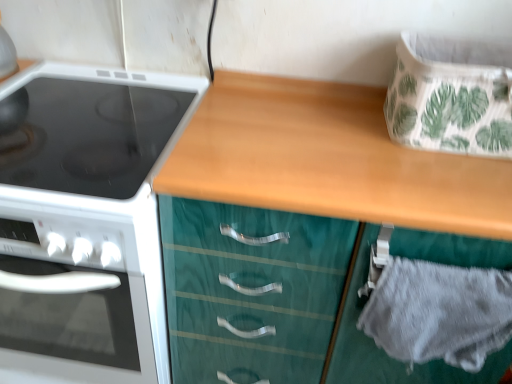
Question: Does gray fabric drawer at lower right, which ranks as the 2th cabinetry in front-to-back order, have a lesser width compared to white glossy electric stove at left?

Choices:
 (A) no
 (B) yes

Answer: (B)

Question: Are gray fabric drawer at lower right, which ranks as the 2th cabinetry in front-to-back order, and white glossy electric stove at left located far from each other?

Choices:
 (A) no
 (B) yes

Answer: (A)

Question: Does gray fabric drawer at lower right, which ranks as the 2th cabinetry in front-to-back order, have a greater width compared to white glossy electric stove at left?

Choices:
 (A) yes
 (B) no

Answer: (B)

Question: Does gray fabric drawer at lower right, which ranks as the 2th cabinetry in front-to-back order, turn towards white glossy electric stove at left?

Choices:
 (A) no
 (B) yes

Answer: (A)

Question: Is gray fabric drawer at lower right, which ranks as the 2th cabinetry in front-to-back order, not inside white glossy electric stove at left?

Choices:
 (A) no
 (B) yes

Answer: (B)

Question: Would you say white glossy electric stove at left is to the left or to the right of teal wood cabinet at center, the 1th cabinetry in the front-to-back sequence, in the picture?

Choices:
 (A) left
 (B) right

Answer: (A)

Question: From the image's perspective, is white glossy electric stove at left positioned above or below teal wood cabinet at center, placed as the 2th cabinetry when sorted from back to front?

Choices:
 (A) above
 (B) below

Answer: (B)

Question: From a real-world perspective, relative to teal wood cabinet at center, placed as the 2th cabinetry when sorted from back to front, is white glossy electric stove at left vertically above or below?

Choices:
 (A) below
 (B) above

Answer: (A)

Question: Considering the positions of white glossy electric stove at left and teal wood cabinet at center, placed as the 2th cabinetry when sorted from back to front, in the image, is white glossy electric stove at left wider or thinner than teal wood cabinet at center, placed as the 2th cabinetry when sorted from back to front,?

Choices:
 (A) wide
 (B) thin

Answer: (A)

Question: Considering their positions, is teal wood cabinet at center, placed as the 2th cabinetry when sorted from back to front, located in front of or behind white glossy electric stove at left?

Choices:
 (A) behind
 (B) front

Answer: (B)

Question: Is teal wood cabinet at center, placed as the 2th cabinetry when sorted from back to front, bigger or smaller than white glossy electric stove at left?

Choices:
 (A) small
 (B) big

Answer: (B)

Question: From a real-world perspective, relative to white glossy electric stove at left, is teal wood cabinet at center, placed as the 2th cabinetry when sorted from back to front, vertically above or below?

Choices:
 (A) below
 (B) above

Answer: (B)

Question: Is point (220, 261) positioned closer to the camera than point (19, 200)?

Choices:
 (A) farther
 (B) closer

Answer: (A)

Question: Which is correct: white glossy electric stove at left is inside gray fabric drawer at lower right, which ranks as the 2th cabinetry in front-to-back order, or outside of it?

Choices:
 (A) inside
 (B) outside

Answer: (B)

Question: In terms of height, does white glossy electric stove at left look taller or shorter compared to gray fabric drawer at lower right, the 1th cabinetry from the back?

Choices:
 (A) tall
 (B) short

Answer: (A)